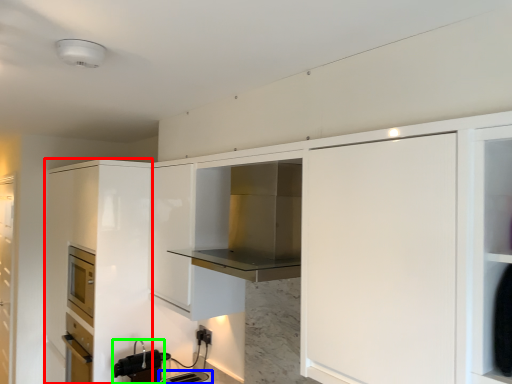
Question: Which object is positioned closest to cabinetry (highlighted by a red box)? Select from appliance (highlighted by a blue box) and appliance (highlighted by a green box).

Choices:
 (A) appliance
 (B) appliance

Answer: (B)